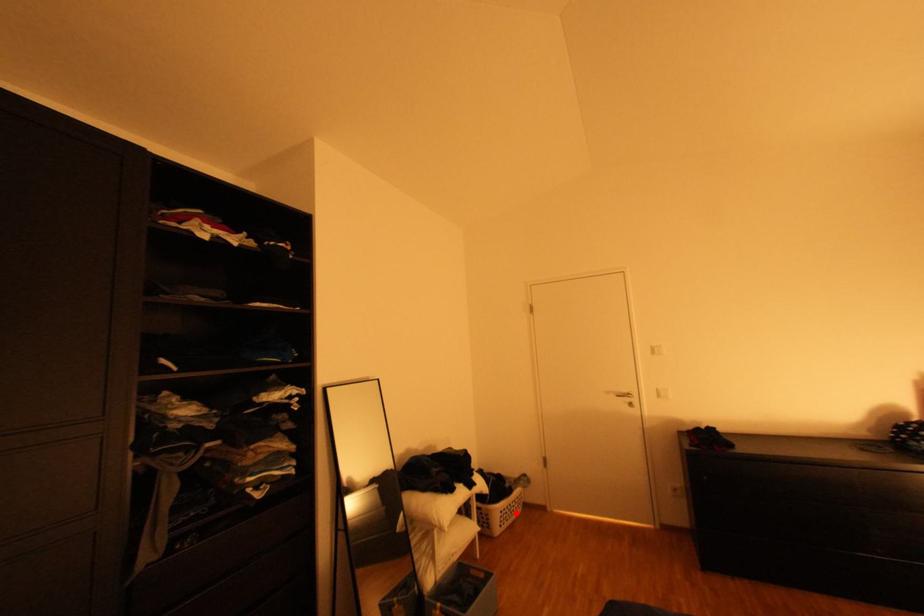
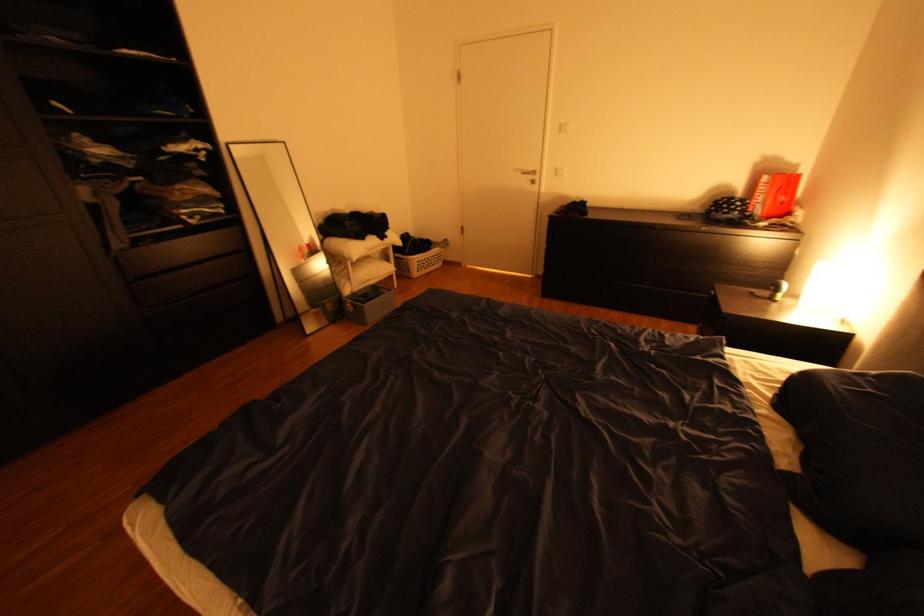
Where in the second image is the point corresponding to the highlighted location from the first image?

(433, 264)